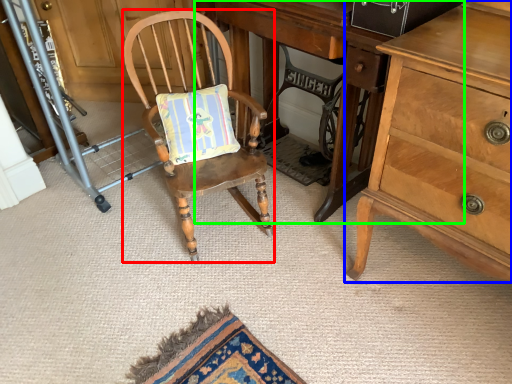
Question: Based on their relative distances, which object is farther from chair (highlighted by a red box)? Choose from chest of drawers (highlighted by a blue box) and desk (highlighted by a green box).

Choices:
 (A) chest of drawers
 (B) desk

Answer: (A)